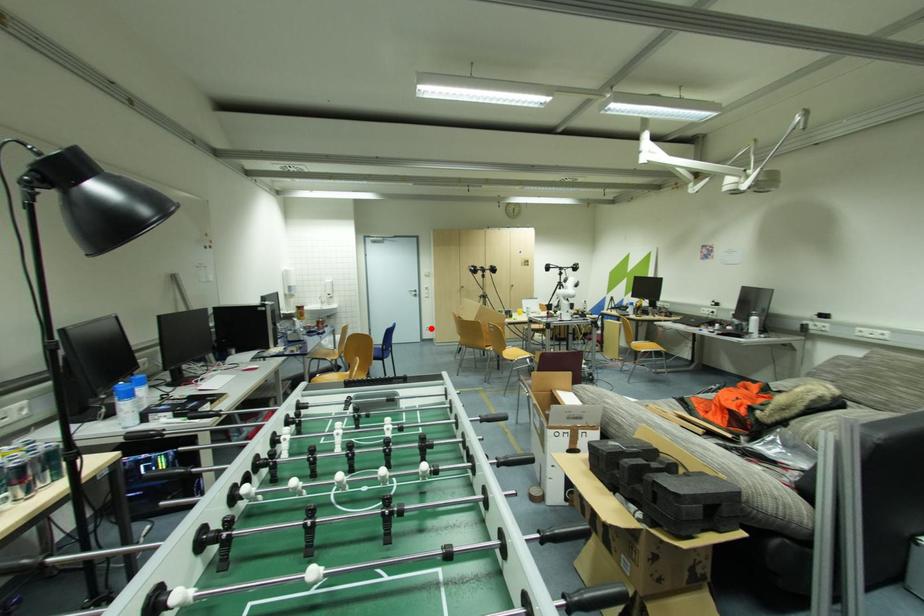
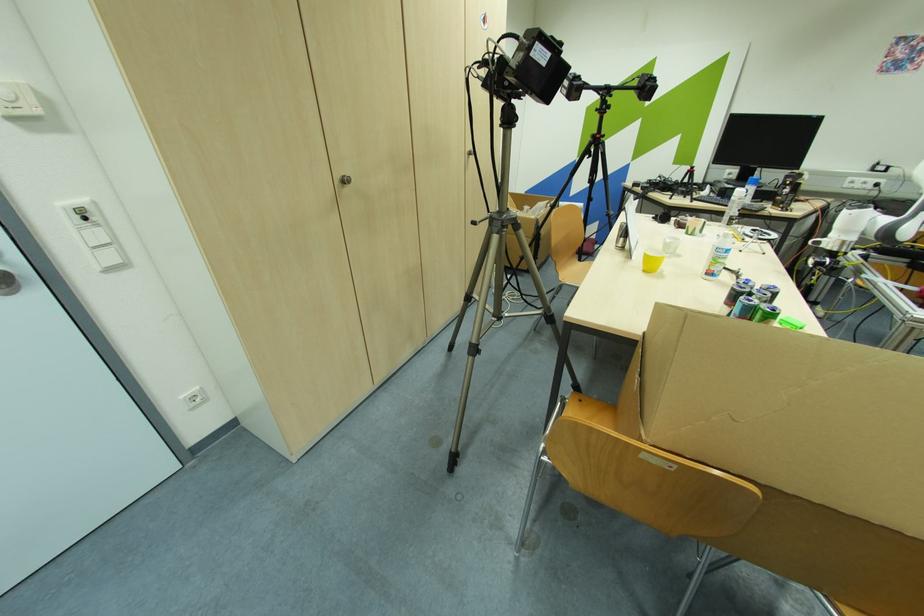
The point at the highlighted location is marked in the first image. Where is the corresponding point in the second image?

(198, 399)